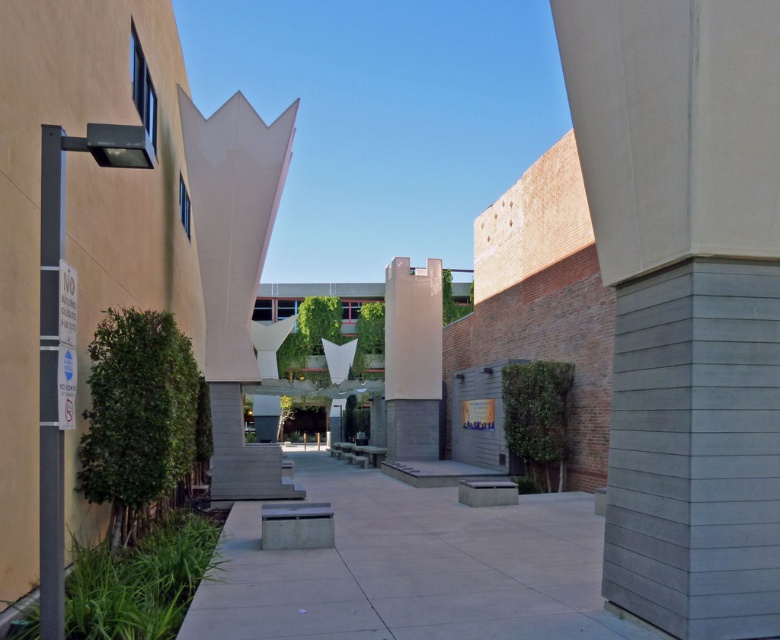
You are a city planner assessing the urban space. You need to install a new security camera that requires a tall structure to cover the entire area. Which object between the gray concrete pillar at right and the smooth concrete pillar at center would be more suitable for mounting the camera?

The gray concrete pillar at right is much taller than the smooth concrete pillar at center, making it more suitable for mounting the security camera to ensure full coverage of the area.

You are a maintenance worker assigned to inspect two structures in the urban space. You need to reach the gray concrete pillar at right first before moving to the white concrete sculpture at center. Based on their positions, is this the most efficient route? Explain why.

The gray concrete pillar at right is located above the white concrete sculpture at center, so starting with the pillar first would require going up, then down to the sculpture. A more efficient route would be to check the white concrete sculpture at center first since it is lower and closer to ground level before ascending to the pillar.

You are an urban planner reviewing this space. There is a white concrete sculpture located at point (234,273). What is the primary material used for this sculpture?

The white concrete sculpture at center is made of concrete.